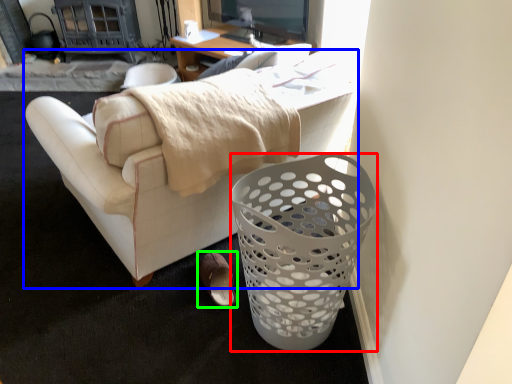
Question: Which is nearer to the trash bin/can (highlighted by a red box)? studio couch (highlighted by a blue box) or footwear (highlighted by a green box).

Choices:
 (A) studio couch
 (B) footwear

Answer: (A)